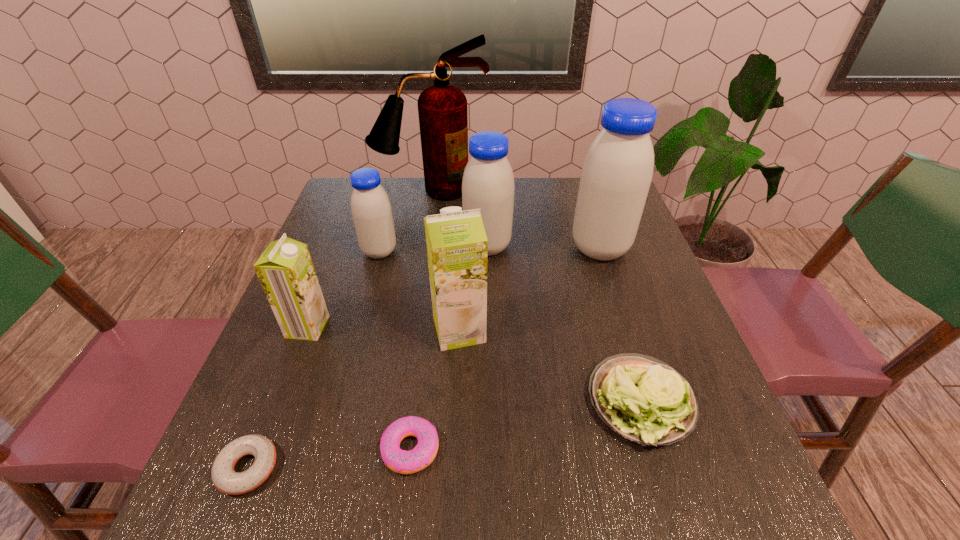
Locate an element on the screen. This screenshot has width=960, height=540. the farthest object is located at coordinates (442, 108).

Where is `red fire extinguisher`? Image resolution: width=960 pixels, height=540 pixels. red fire extinguisher is located at coordinates (442, 108).

Find the location of `the tallest soya milk`. the tallest soya milk is located at coordinates (616, 175).

I want to click on the rightmost soya milk, so click(x=616, y=175).

The width and height of the screenshot is (960, 540). Identify the location of the second biggest blue soya milk. (488, 184).

Locate an element on the screen. Image resolution: width=960 pixels, height=540 pixels. the right green soya milk is located at coordinates (457, 247).

The height and width of the screenshot is (540, 960). I want to click on the smaller green soya milk, so pos(285,269).

Find the location of a particular element. the left green soya milk is located at coordinates (285, 269).

Identify the location of the leftmost blue soya milk. (371, 210).

Image resolution: width=960 pixels, height=540 pixels. I want to click on the smallest blue soya milk, so 371,210.